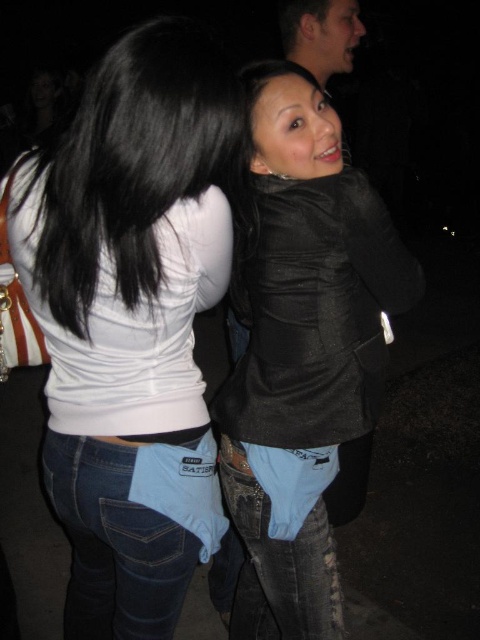
Is black leather jacket at center to the right of matte black hair at upper center from the viewer's perspective?

In fact, black leather jacket at center is to the left of matte black hair at upper center.

Which is behind, point (242, 205) or point (336, 54)?

Positioned behind is point (336, 54).

Is point (263, 376) closer to camera compared to point (312, 26)?

That is True.

The image size is (480, 640). What are the coordinates of `black leather jacket at center` in the screenshot? It's located at (301, 349).

Can you confirm if white matte tank top at upper left is shorter than matte black hair at upper center?

No, white matte tank top at upper left is not shorter than matte black hair at upper center.

Measure the distance between point [152,609] and camera.

Point [152,609] is 3.85 feet away from camera.

You are a GUI agent. You are given a task and a screenshot of the screen. Output one action in this format:
    pyautogui.click(x=<x>, y=<y>)
    Task: Click on the white matte tank top at upper left
    
    Given the screenshot: What is the action you would take?
    pyautogui.click(x=131, y=317)

What do you see at coordinates (131, 317) in the screenshot? The width and height of the screenshot is (480, 640). I see `white matte tank top at upper left` at bounding box center [131, 317].

The height and width of the screenshot is (640, 480). In order to click on white matte tank top at upper left in this screenshot , I will do `click(131, 317)`.

Locate an element on the screen. The width and height of the screenshot is (480, 640). white matte tank top at upper left is located at coordinates coord(131,317).